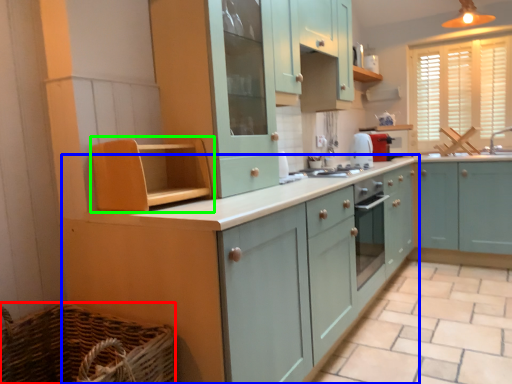
Question: Which is nearer to the basket (highlighted by a red box)? cabinetry (highlighted by a blue box) or cabinetry (highlighted by a green box).

Choices:
 (A) cabinetry
 (B) cabinetry

Answer: (A)